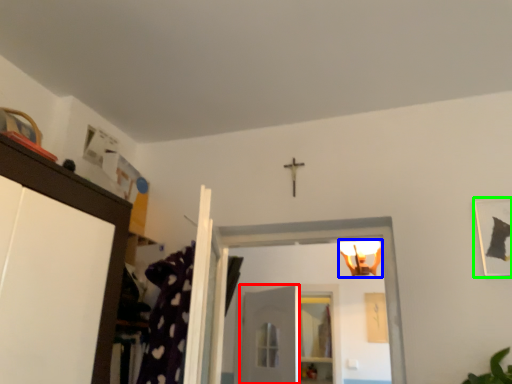
Question: Considering the real-world distances, which object is farthest from door (highlighted by a red box)? light fixture (highlighted by a blue box) or picture frame (highlighted by a green box)?

Choices:
 (A) light fixture
 (B) picture frame

Answer: (B)